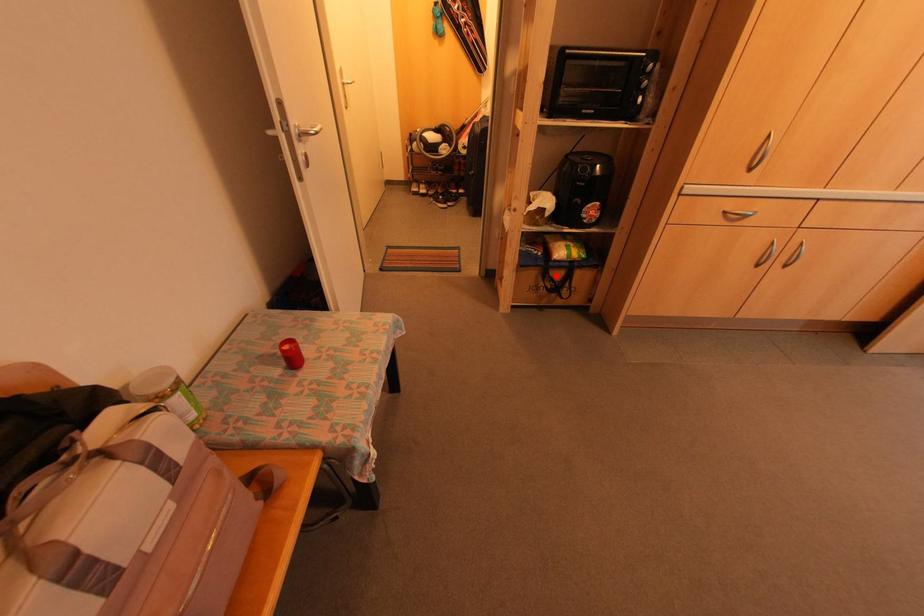
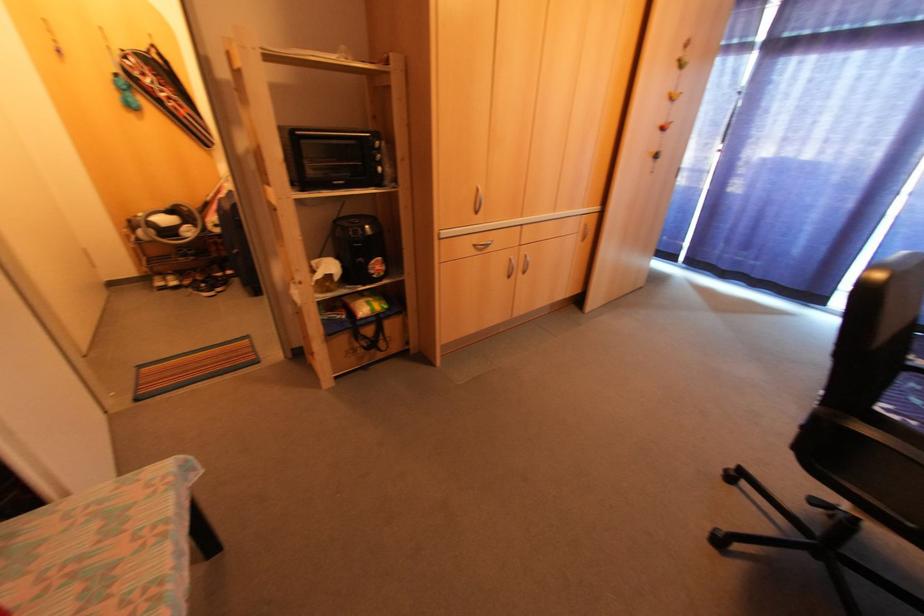
Question: I am providing you with two images of the same scene from different viewpoints. Image1 has a red point marked. In image2, the corresponding 3D location appears at what relative position? Reply with the corresponding letter.

Choices:
 (A) Closer
 (B) Farther

Answer: (B)